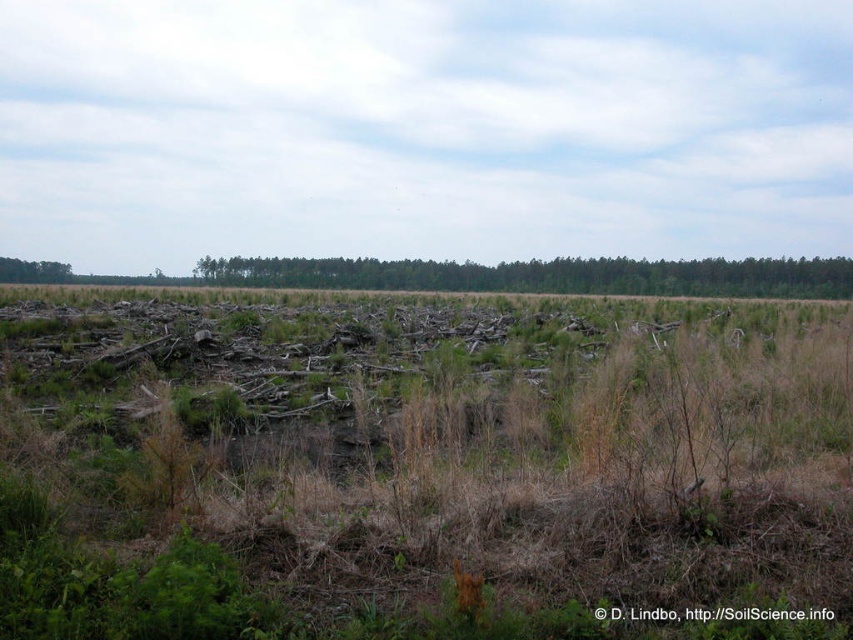
You are standing at the point with coordinates 0.5, 0.5 in the image. You want to reach the green leafy trees at center. In which direction should you move?

You should move towards the northwest direction to reach the green leafy trees at center located at point [544,275] from your current position at [426,320].

You are standing in the disturbed area of the landscape and want to reach the green leafy tree at upper left. Which direction should you move relative to the green leafy trees at center?

Since the green leafy trees at center are in front of the green leafy tree at upper left, you should move behind the green leafy trees at center to reach the green leafy tree at upper left.

You are a hiker trying to navigate through the landscape. You see the green leafy trees at center and the green leafy tree at upper left. Which one is lower in the image?

The green leafy trees at center is located below the green leafy tree at upper left, so the green leafy trees at center is lower in the image.